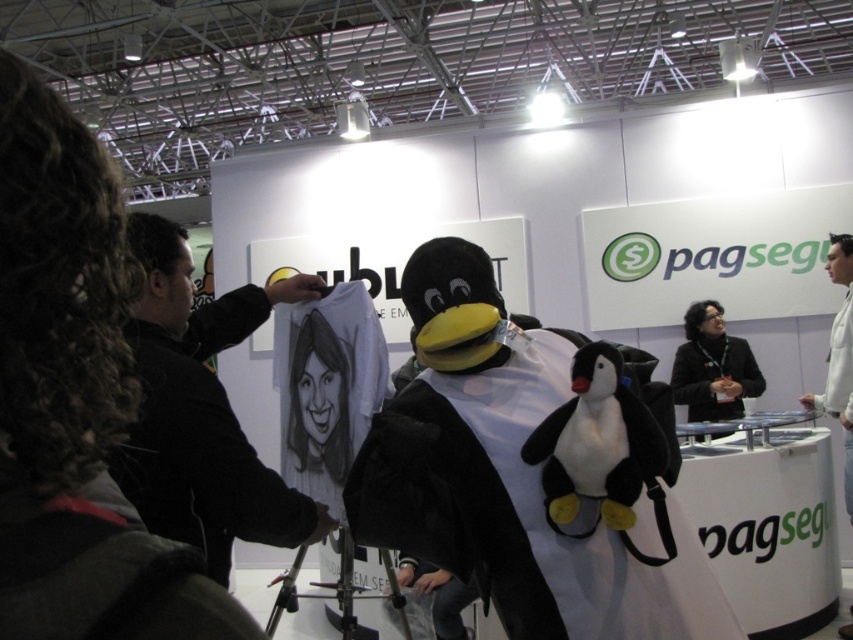
You are at a trade show booth for PagSeguro and need to hand out promotional items. There is a velvet black penguin at center and a black fabric at center. Which object should you target to ensure the promotional item is clearly visible to attendees?

The velvet black penguin at center is in front of the black fabric at center, so the promotional item should be placed on or near the velvet black penguin at center to ensure visibility against the background.

You are a photographer standing at the event. You want to take a photo of the velvet black penguin at center from a distance that allows you to capture the entire penguin in the frame without any cropping. Your camera has a minimum focusing distance of 1.2 meters. Can you take the photo from your current position?

The velvet black penguin at center is 1.17 meters away from the camera. Since the minimum focusing distance of your camera is 1.2 meters, you need to move back slightly to ensure the penguin is within the camera range. Otherwise, the image may be out of focus or too close to frame properly.

You are a photographer at the pagseguro booth. You need to capture a photo where both the velvet black penguin at center and the black fabric at center are visible. Which object should you focus on to ensure the taller one is in frame first?

The black fabric at center is taller than the velvet black penguin at center. To ensure the taller object is in frame first, focus on the black fabric at center.